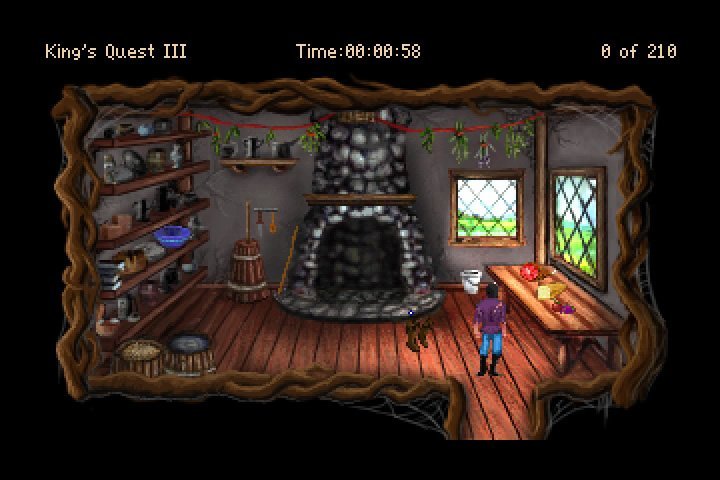
Locate an element on the screen. The height and width of the screenshot is (480, 720). bucket is located at coordinates (476, 284).